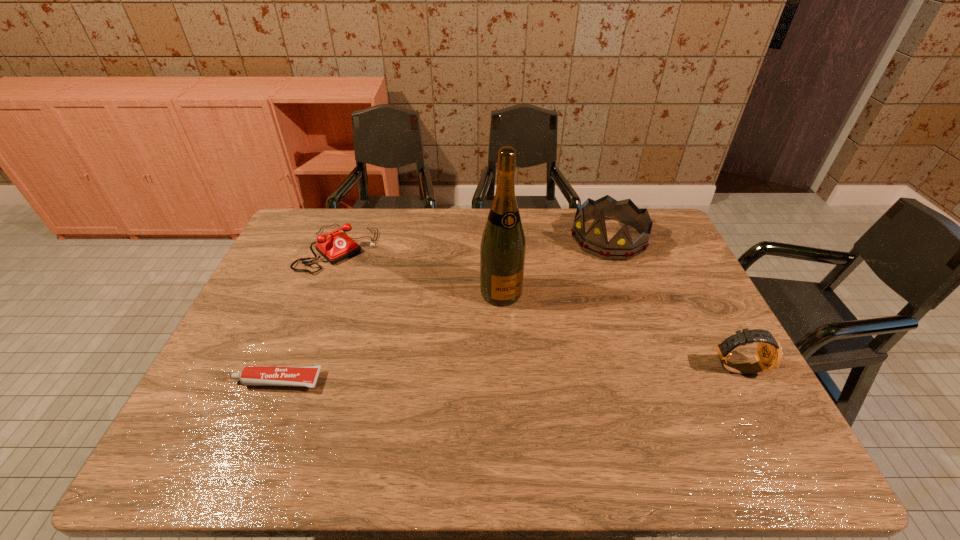
At what (x,y) coordinates should I click in order to perform the action: click on free space between the tiara and the third shortest object. Please return your answer as a coordinate pair (x, y). Looking at the image, I should click on (672, 303).

Identify the location of vacant space in between the second shortest object and the third shortest object. The image size is (960, 540). (537, 308).

This screenshot has height=540, width=960. Identify the location of object that stands as the closest to the third object from left to right. coord(595,241).

Locate an element on the screen. This screenshot has height=540, width=960. object that ranks as the third closest to the shortest object is located at coordinates (595, 241).

This screenshot has width=960, height=540. In order to click on vacant area in the image that satisfies the following two spatial constraints: 1. on the front side of the third farthest object; 2. on the face of the rightmost object in this screenshot , I will do `click(505, 368)`.

The height and width of the screenshot is (540, 960). I want to click on free location that satisfies the following two spatial constraints: 1. on the front side of the rightmost object; 2. on the face of the wine bottle, so click(505, 368).

Locate an element on the screen. The image size is (960, 540). free space that satisfies the following two spatial constraints: 1. on the front side of the third object from right to left; 2. on the left side of the telephone is located at coordinates click(x=322, y=293).